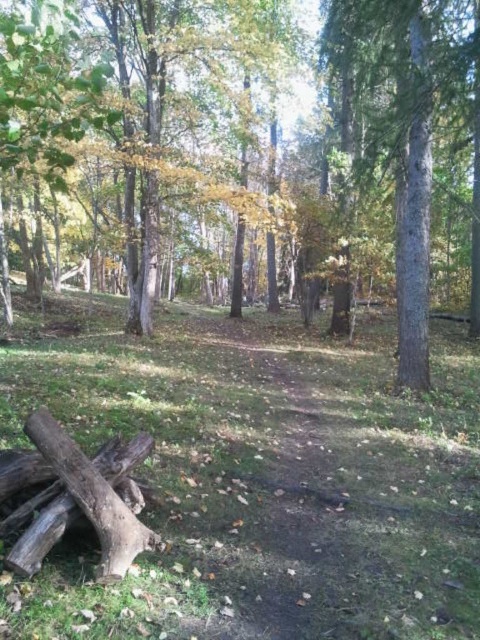
Between point (399, 202) and point (78, 460), which one is positioned behind?

The point (399, 202) is behind.

Does point (22, 132) come in front of point (120, 512)?

No, it is not.

The width and height of the screenshot is (480, 640). Identify the location of brown wood tree at center. (253, 140).

Does green smooth tree at right have a greater width compared to brown rough wood at lower left?

Indeed, green smooth tree at right has a greater width compared to brown rough wood at lower left.

Between green smooth tree at right and brown rough wood at lower left, which one is positioned higher?

Positioned higher is green smooth tree at right.

I want to click on green smooth tree at right, so click(407, 134).

The height and width of the screenshot is (640, 480). I want to click on green smooth tree at right, so click(407, 134).

Who is positioned more to the right, brown rough wood at lower left or smooth gray tree trunk at right?

From the viewer's perspective, smooth gray tree trunk at right appears more on the right side.

Who is taller, brown rough wood at lower left or smooth gray tree trunk at right?

smooth gray tree trunk at right

Locate an element on the screen. The width and height of the screenshot is (480, 640). brown rough wood at lower left is located at coordinates (87, 500).